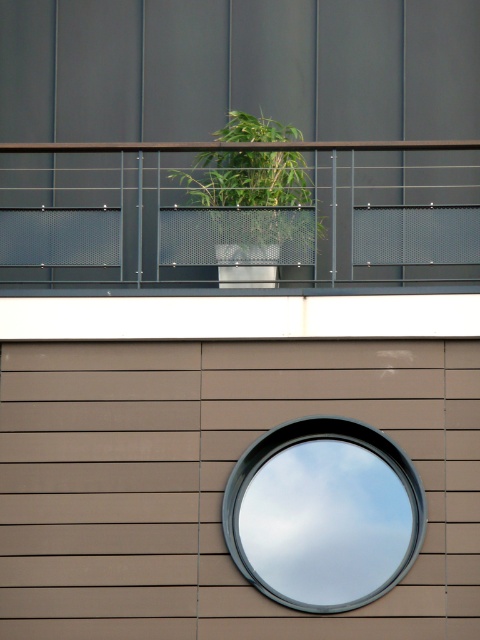
Can you confirm if white plastic pot at upper center is bigger than green leafy plant at center?

Yes, white plastic pot at upper center is bigger than green leafy plant at center.

Is point (110, 259) positioned behind point (250, 170)?

No, it is not.

The image size is (480, 640). I want to click on white plastic pot at upper center, so click(224, 208).

Which of these two, smooth glass mirror at center or green leafy plant at center, stands shorter?

With less height is green leafy plant at center.

Between point (255, 529) and point (288, 163), which one is positioned behind?

Point (288, 163)

At what (x,y) coordinates should I click in order to perform the action: click on smooth glass mirror at center. Please return your answer as a coordinate pair (x, y). The image size is (480, 640). Looking at the image, I should click on (324, 513).

You are a GUI agent. You are given a task and a screenshot of the screen. Output one action in this format:
    pyautogui.click(x=<x>, y=<y>)
    Task: Click on the white plastic pot at upper center
    The image size is (480, 640).
    Given the screenshot: What is the action you would take?
    pyautogui.click(x=224, y=208)

Between white plastic pot at upper center and smooth glass mirror at center, which one appears on the right side from the viewer's perspective?

smooth glass mirror at center is more to the right.

Does point (34, 262) lie in front of point (278, 522)?

No, it is not.

Find the location of a particular element. The image size is (480, 640). white plastic pot at upper center is located at coordinates (224, 208).